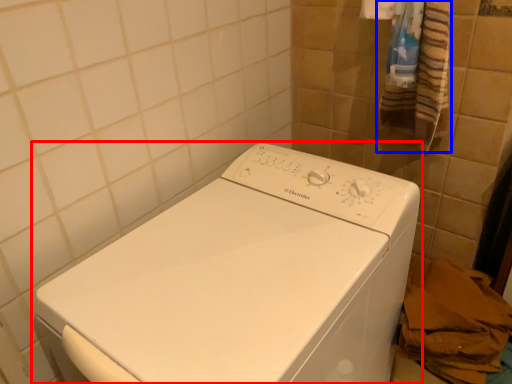
Question: Among these objects, which one is nearest to the camera, washing machine (highlighted by a red box) or bath towel (highlighted by a blue box)?

Choices:
 (A) washing machine
 (B) bath towel

Answer: (A)